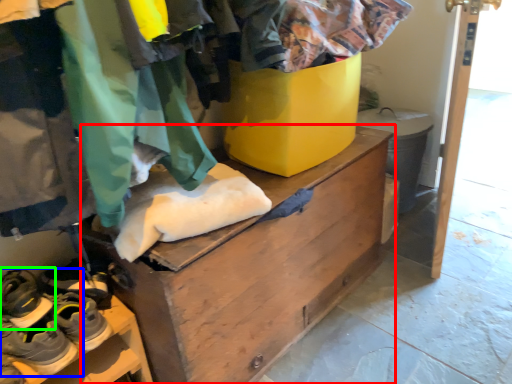
Question: Which is farther away from chest of drawers (highlighted by a red box)? footwear (highlighted by a blue box) or footwear (highlighted by a green box)?

Choices:
 (A) footwear
 (B) footwear

Answer: (B)